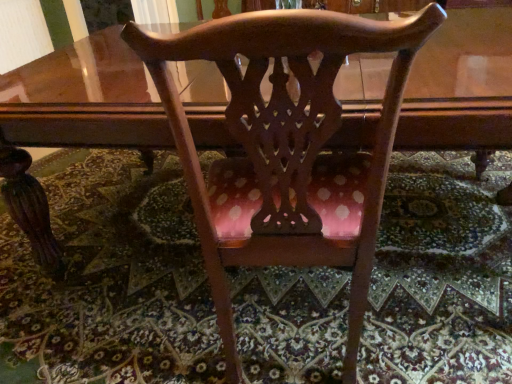
Question: Is carpeted floor at center smaller than polished wood chair at center?

Choices:
 (A) yes
 (B) no

Answer: (A)

Question: Does carpeted floor at center appear on the left side of polished wood chair at center?

Choices:
 (A) no
 (B) yes

Answer: (B)

Question: Considering the relative positions of carpeted floor at center and polished wood chair at center in the image provided, is carpeted floor at center to the right of polished wood chair at center from the viewer's perspective?

Choices:
 (A) no
 (B) yes

Answer: (A)

Question: Does carpeted floor at center turn towards polished wood chair at center?

Choices:
 (A) yes
 (B) no

Answer: (B)

Question: Does carpeted floor at center lie in front of polished wood chair at center?

Choices:
 (A) yes
 (B) no

Answer: (B)

Question: From the image's perspective, is carpeted floor at center located above polished wood chair at center?

Choices:
 (A) yes
 (B) no

Answer: (B)

Question: From the image's perspective, is polished wood chair at center below carpeted floor at center?

Choices:
 (A) no
 (B) yes

Answer: (A)

Question: Does polished wood chair at center have a lesser height compared to carpeted floor at center?

Choices:
 (A) no
 (B) yes

Answer: (A)

Question: Is polished wood chair at center not close to carpeted floor at center?

Choices:
 (A) yes
 (B) no

Answer: (B)

Question: Can you confirm if polished wood chair at center is thinner than carpeted floor at center?

Choices:
 (A) no
 (B) yes

Answer: (B)

Question: From a real-world perspective, does polished wood chair at center stand above carpeted floor at center?

Choices:
 (A) no
 (B) yes

Answer: (B)

Question: From a real-world perspective, is polished wood chair at center beneath carpeted floor at center?

Choices:
 (A) no
 (B) yes

Answer: (A)

Question: From a real-world perspective, is carpeted floor at center above or below polished wood chair at center?

Choices:
 (A) below
 (B) above

Answer: (A)